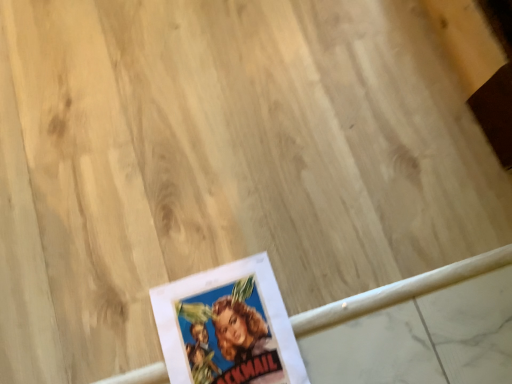
Find the location of a particular element. matte paper picture frame at lower center is located at coordinates (227, 327).

The image size is (512, 384). What do you see at coordinates (227, 327) in the screenshot?
I see `matte paper picture frame at lower center` at bounding box center [227, 327].

The width and height of the screenshot is (512, 384). What are the coordinates of `matte paper picture frame at lower center` in the screenshot? It's located at (227, 327).